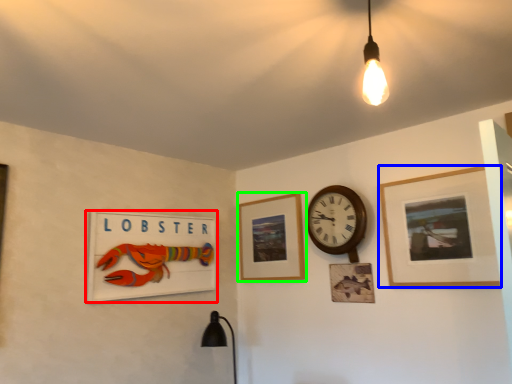
Question: Considering the real-world distances, which object is farthest from picture frame (highlighted by a red box)? picture frame (highlighted by a blue box) or picture frame (highlighted by a green box)?

Choices:
 (A) picture frame
 (B) picture frame

Answer: (A)